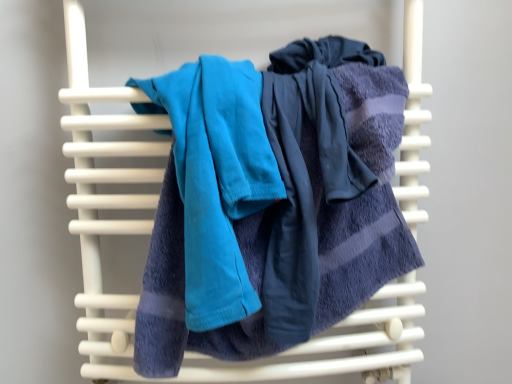
Question: Is soft blue towel at center, which ranks as the 2th towel in left-to-right order, taller than teal fabric towel at center, the first towel in the left-to-right sequence?

Choices:
 (A) no
 (B) yes

Answer: (B)

Question: From the image's perspective, is soft blue towel at center, arranged as the first towel when viewed from the right, on teal fabric towel at center, acting as the 2th towel starting from the right?

Choices:
 (A) no
 (B) yes

Answer: (A)

Question: Is soft blue towel at center, arranged as the first towel when viewed from the right, placed right next to teal fabric towel at center, the first towel in the left-to-right sequence?

Choices:
 (A) no
 (B) yes

Answer: (B)

Question: Is the position of soft blue towel at center, which ranks as the 2th towel in left-to-right order, more distant than that of teal fabric towel at center, acting as the 2th towel starting from the right?

Choices:
 (A) yes
 (B) no

Answer: (A)

Question: From the image's perspective, is soft blue towel at center, which ranks as the 2th towel in left-to-right order, below teal fabric towel at center, acting as the 2th towel starting from the right?

Choices:
 (A) no
 (B) yes

Answer: (B)

Question: Considering the relative sizes of soft blue towel at center, which ranks as the 2th towel in left-to-right order, and teal fabric towel at center, the first towel in the left-to-right sequence, in the image provided, is soft blue towel at center, which ranks as the 2th towel in left-to-right order, shorter than teal fabric towel at center, the first towel in the left-to-right sequence,?

Choices:
 (A) yes
 (B) no

Answer: (B)

Question: Can you confirm if teal fabric towel at center, the first towel in the left-to-right sequence, is taller than soft blue towel at center, arranged as the first towel when viewed from the right?

Choices:
 (A) yes
 (B) no

Answer: (B)

Question: Can you confirm if teal fabric towel at center, acting as the 2th towel starting from the right, is smaller than soft blue towel at center, arranged as the first towel when viewed from the right?

Choices:
 (A) yes
 (B) no

Answer: (A)

Question: Is teal fabric towel at center, acting as the 2th towel starting from the right, wider than soft blue towel at center, which ranks as the 2th towel in left-to-right order?

Choices:
 (A) no
 (B) yes

Answer: (A)

Question: Is teal fabric towel at center, the first towel in the left-to-right sequence, thinner than soft blue towel at center, which ranks as the 2th towel in left-to-right order?

Choices:
 (A) yes
 (B) no

Answer: (A)

Question: Are teal fabric towel at center, acting as the 2th towel starting from the right, and soft blue towel at center, arranged as the first towel when viewed from the right, making contact?

Choices:
 (A) yes
 (B) no

Answer: (A)

Question: Is the depth of teal fabric towel at center, acting as the 2th towel starting from the right, less than that of soft blue towel at center, which ranks as the 2th towel in left-to-right order?

Choices:
 (A) no
 (B) yes

Answer: (B)

Question: In terms of width, does soft blue towel at center, arranged as the first towel when viewed from the right, look wider or thinner when compared to teal fabric towel at center, acting as the 2th towel starting from the right?

Choices:
 (A) wide
 (B) thin

Answer: (A)